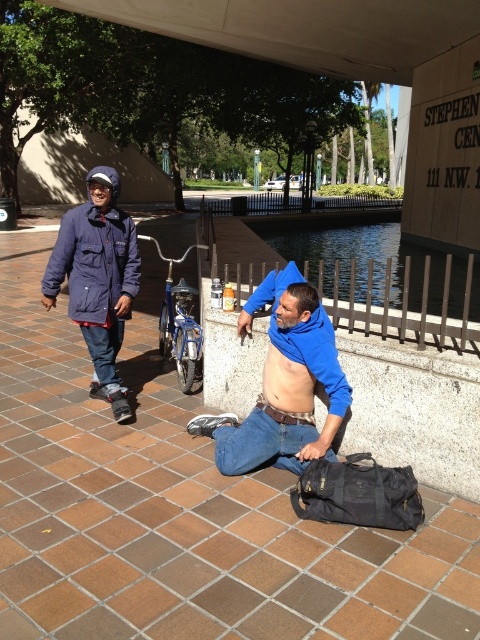
Question: Which is nearer to the blue cotton jacket at center?

Choices:
 (A) blue matte shirt at center
 (B) navy blue jacket at left

Answer: (A)

Question: Which object appears closest to the camera in this image?

Choices:
 (A) blue matte shirt at center
 (B) blue cotton jacket at center
 (C) navy blue jacket at left

Answer: (A)

Question: Does navy blue jacket at left appear on the right side of blue cotton jacket at center?

Choices:
 (A) no
 (B) yes

Answer: (A)

Question: Does blue matte shirt at center have a larger size compared to navy blue jacket at left?

Choices:
 (A) no
 (B) yes

Answer: (A)

Question: Is blue cotton jacket at center bigger than muscle at center?

Choices:
 (A) yes
 (B) no

Answer: (A)

Question: Which point is farther to the camera?

Choices:
 (A) (12, 534)
 (B) (118, 348)
 (C) (240, 330)

Answer: (B)